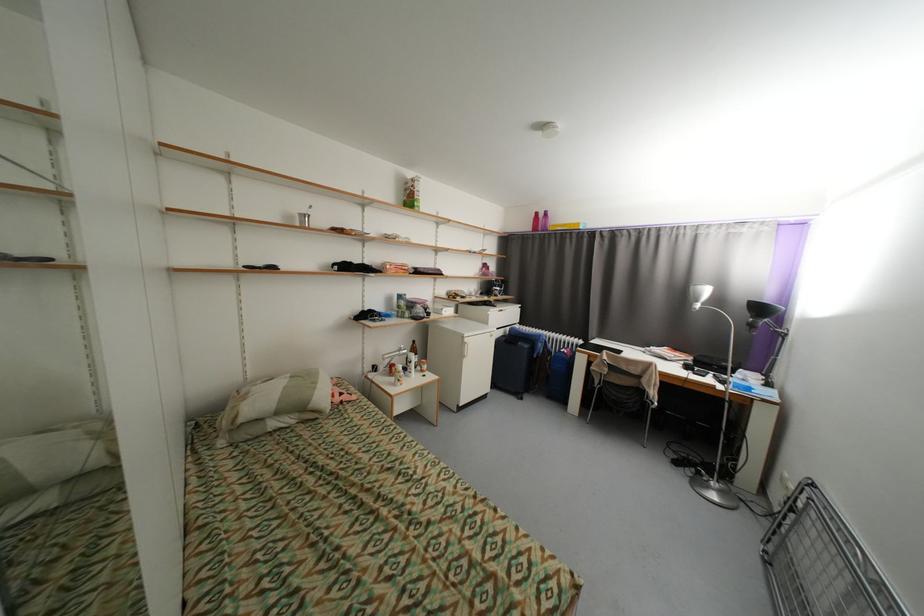
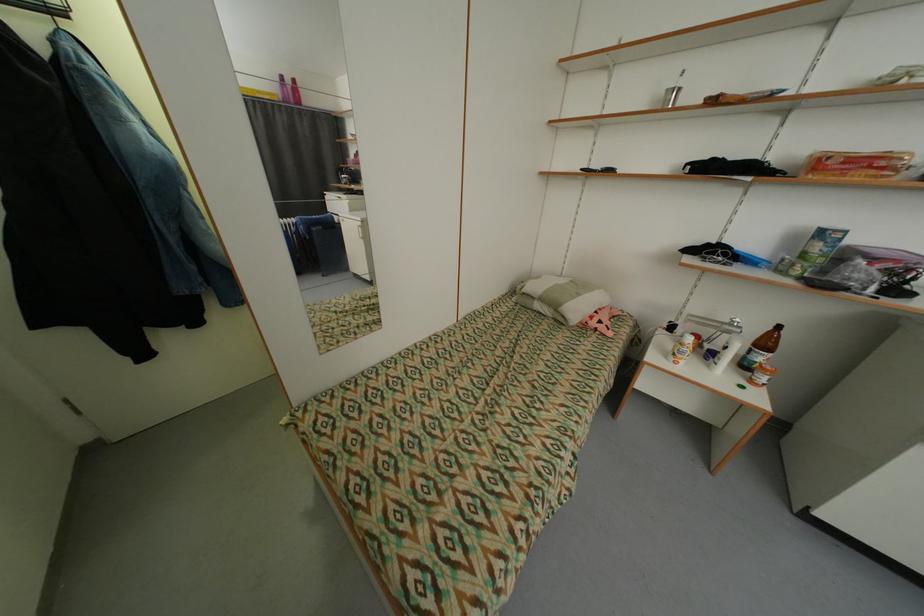
Locate, in the second image, the point that corresponds to point 322,384 in the first image.

(585, 296)